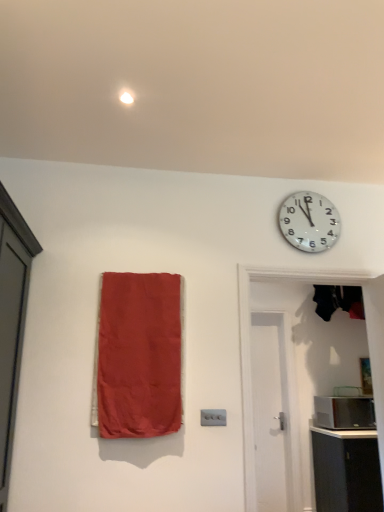
Question: From the image's perspective, relative to white wooden door at right, marked as the 1th door in a back-to-front arrangement, is matte black cabinet at lower right above or below?

Choices:
 (A) above
 (B) below

Answer: (B)

Question: Considering the relative positions of matte black cabinet at lower right and white wooden door at right, marked as the 1th door in a back-to-front arrangement, in the image provided, is matte black cabinet at lower right to the left or to the right of white wooden door at right, marked as the 1th door in a back-to-front arrangement,?

Choices:
 (A) left
 (B) right

Answer: (B)

Question: Which object is the farthest from the black glossy microwave at right?

Choices:
 (A) white matte door at right, which ranks as the first door in front-to-back order
 (B) white glossy wall clock at upper right
 (C) matte fabric curtain at left
 (D) matte black cabinet at lower right
 (E) white wooden door at right, the 2th door in the front-to-back sequence

Answer: (C)

Question: Which is farther from the white glossy wall clock at upper right?

Choices:
 (A) white wooden door at right, marked as the 1th door in a back-to-front arrangement
 (B) matte black cabinet at lower right
 (C) white matte door at right, which ranks as the first door in front-to-back order
 (D) black glossy microwave at right
 (E) matte fabric curtain at left

Answer: (B)